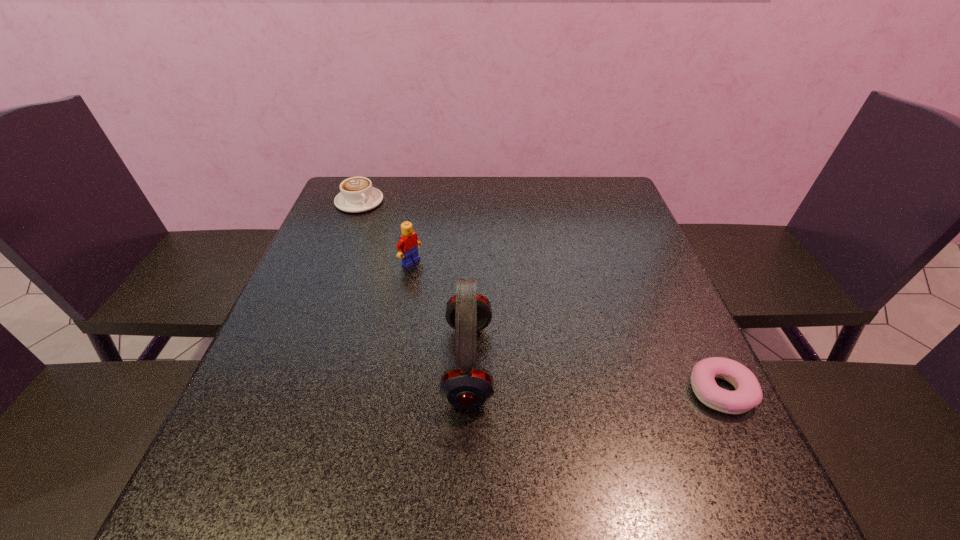
What are the coordinates of `object that is the third closest to the second shortest object` in the screenshot? It's located at (748, 394).

The height and width of the screenshot is (540, 960). Find the location of `object that is the second closest to the third tallest object`. object that is the second closest to the third tallest object is located at coordinates (466, 385).

This screenshot has width=960, height=540. Identify the location of blank space that satisfies the following two spatial constraints: 1. on the front side of the tallest object; 2. on the ear cups of the third tallest object. (296, 363).

Where is `vacant space that satisfies the following two spatial constraints: 1. on the front side of the earphone; 2. on the ear cups of the second farthest object`? This screenshot has height=540, width=960. vacant space that satisfies the following two spatial constraints: 1. on the front side of the earphone; 2. on the ear cups of the second farthest object is located at coordinates pos(392,363).